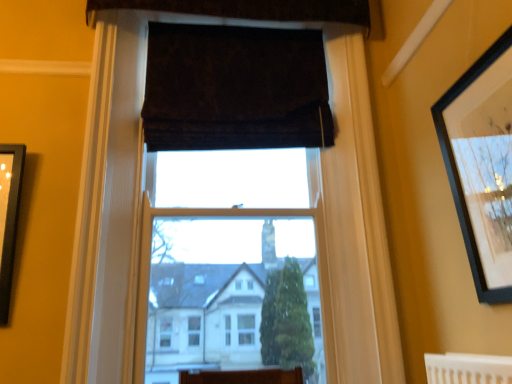
Question: From a real-world perspective, relative to dark brown velvet curtain at upper center, which appears as the second curtain when ordered from the bottom, is dark velvet curtain at upper center, the first curtain in the bottom-to-top sequence, vertically above or below?

Choices:
 (A) below
 (B) above

Answer: (A)

Question: Is dark velvet curtain at upper center, the first curtain in the bottom-to-top sequence, wider or thinner than dark brown velvet curtain at upper center, which appears as the second curtain when ordered from the bottom?

Choices:
 (A) thin
 (B) wide

Answer: (B)

Question: Which is nearer to the black matte picture frame at upper right?

Choices:
 (A) dark brown velvet curtain at upper center, which appears as the second curtain when ordered from the bottom
 (B) dark velvet curtain at upper center, which ranks as the 2th curtain in top-to-bottom order
 (C) white wood window frame at center

Answer: (C)

Question: Estimate the real-world distances between objects in this image. Which object is farther from the dark velvet curtain at upper center, the first curtain in the bottom-to-top sequence?

Choices:
 (A) black matte picture frame at upper right
 (B) white wood window frame at center
 (C) dark brown velvet curtain at upper center, which appears as the 1th curtain when viewed from the top

Answer: (A)